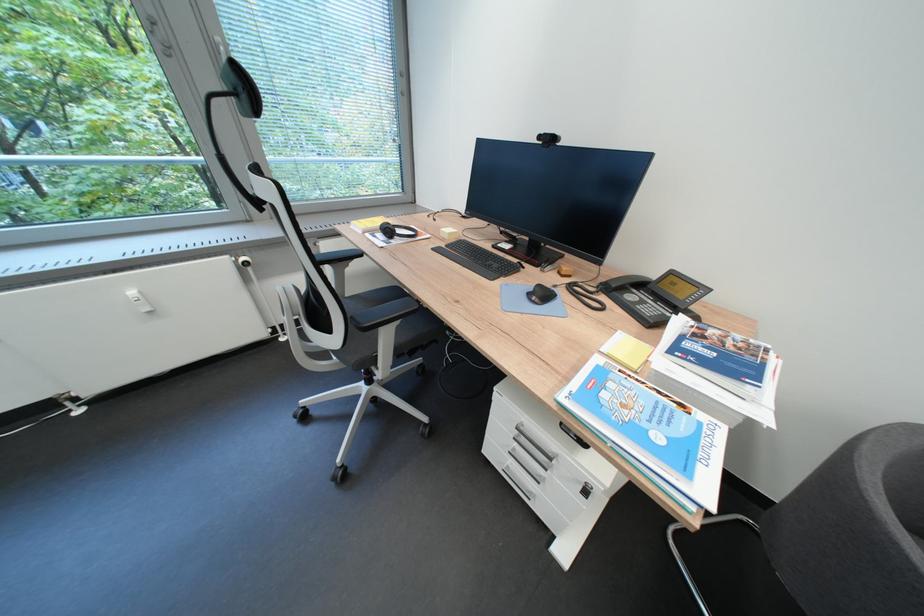
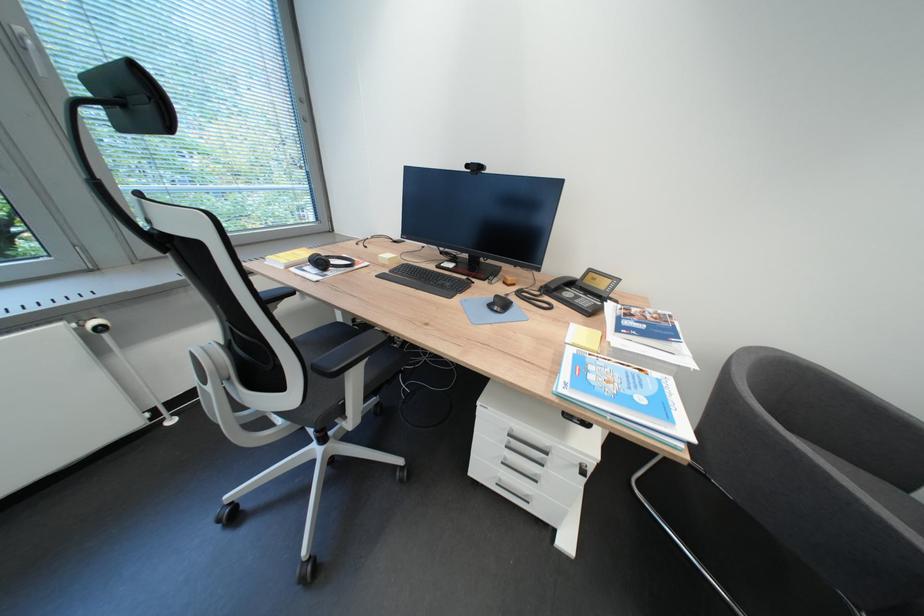
Question: What movement of the cameraman would produce the second image?

Choices:
 (A) Left
 (B) Right
 (C) Forward
 (D) Backward

Answer: (A)